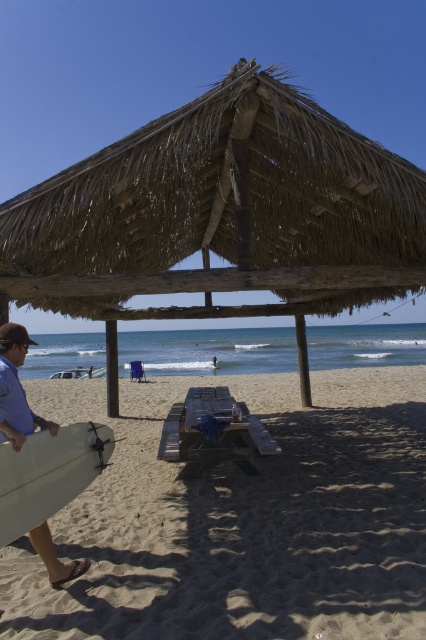
Question: Which of the following is the farthest from the observer?

Choices:
 (A) thatched straw hut at center
 (B) white matte surfboard at lower left
 (C) sandy beach at lower left

Answer: (A)

Question: Can you confirm if sandy beach at lower left is smaller than white matte surfboard at lower left?

Choices:
 (A) no
 (B) yes

Answer: (A)

Question: Which object appears closest to the camera in this image?

Choices:
 (A) wooden picnic table at center
 (B) thatched straw hut at center
 (C) sandy beach at lower left
 (D) white foam surfboard at left

Answer: (C)

Question: Is sandy beach at lower left closer to the viewer compared to wooden picnic table at center?

Choices:
 (A) yes
 (B) no

Answer: (A)

Question: Which object is positioned closest to the sandy beach at lower left?

Choices:
 (A) wooden picnic table at center
 (B) white matte surfboard at lower left

Answer: (A)

Question: Does thatched straw hut at center appear on the left side of wooden picnic table at center?

Choices:
 (A) yes
 (B) no

Answer: (A)